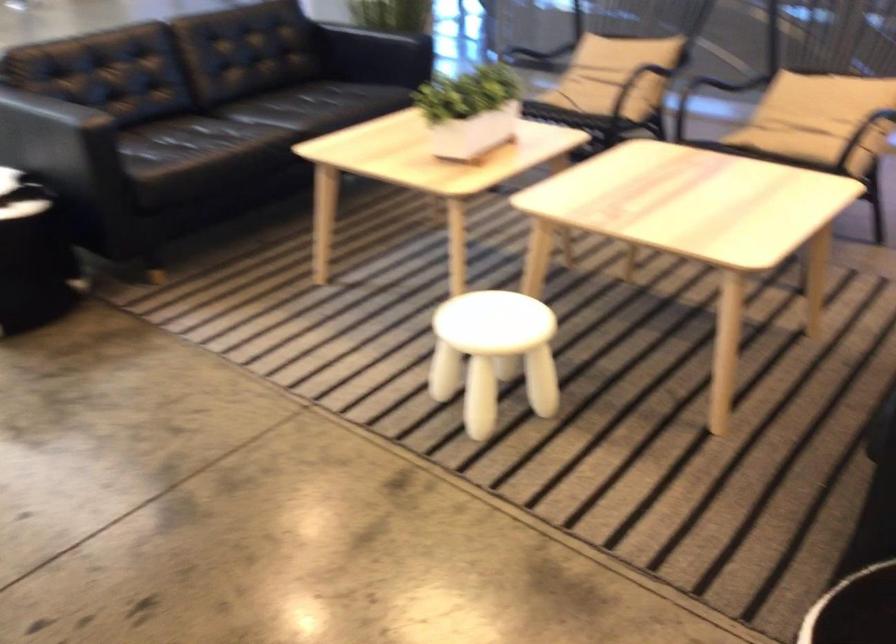
Find where to lift the white planter. Please return your answer as a coordinate pair (x, y).

(470, 111)